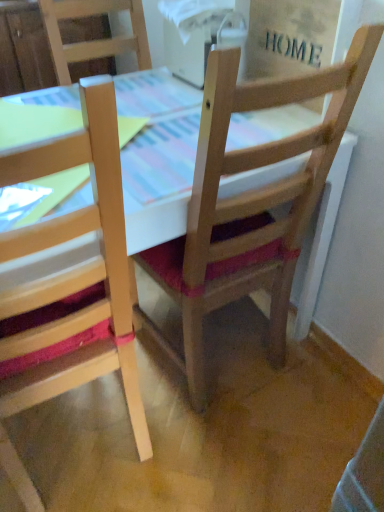
The height and width of the screenshot is (512, 384). I want to click on vacant space in front of wooden chair at center, which is the 1th chair in right-to-left order, so click(242, 452).